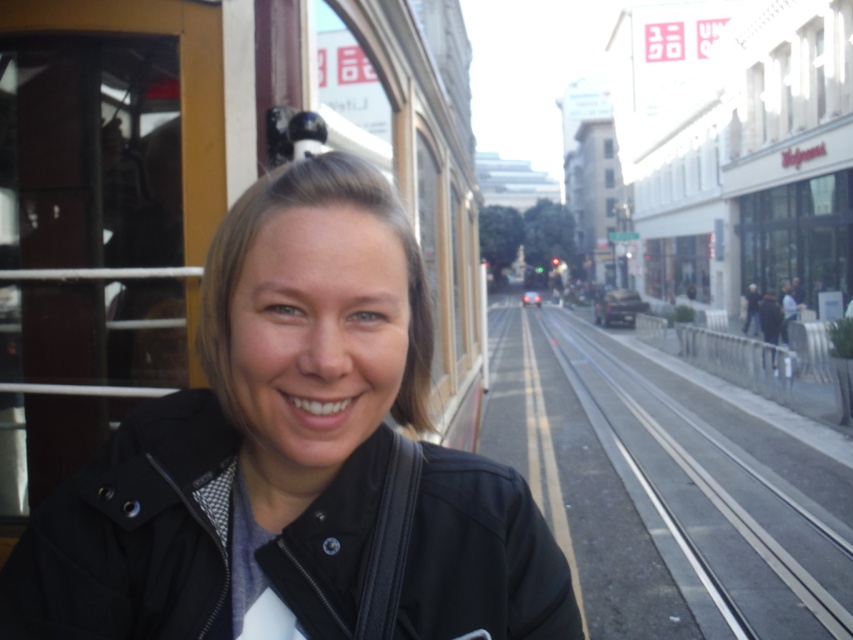
You are a pedestrian standing on the street and see the black matte jacket at left and the metal train track at center. Which object is closer to you?

The black matte jacket at left is closer to you because it is in front of the metal train track at center.

You are standing at the point labeled point (756,419) and want to walk to the point labeled point (430,477). Which direction should you move relative to the tram?

You should move forward towards the tram because point (430,477) is in front of point (756,419) relative to the tram.

You are a pedestrian standing on the street and see the black matte jacket at left and the metal train track at center. How far apart are these two objects?

The black matte jacket at left is 5.21 meters from the metal train track at center.